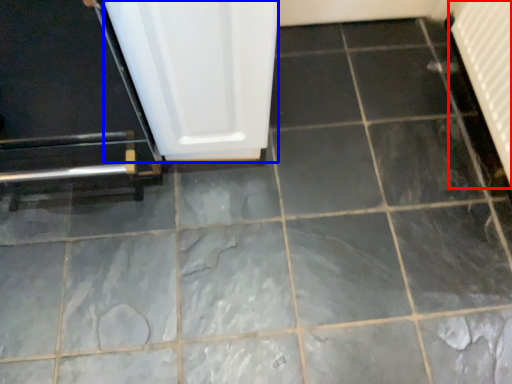
Question: Which object is closer to the camera taking this photo, radiator (highlighted by a red box) or screen door (highlighted by a blue box)?

Choices:
 (A) radiator
 (B) screen door

Answer: (B)